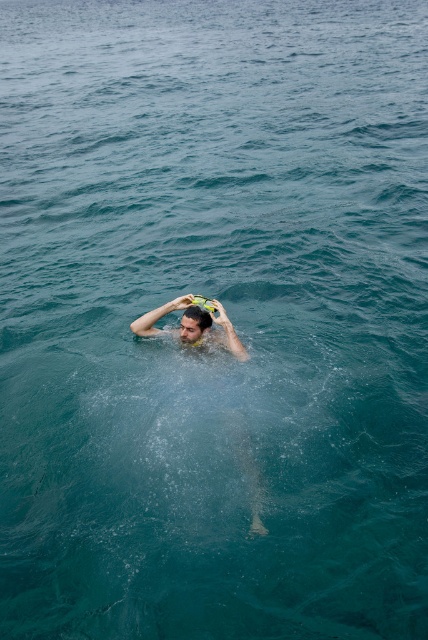
You are a photographer trying to capture the smooth skin man at center and the matte black hair at upper center in a single shot. Which object should you focus on first to ensure both are in focus?

You should focus on the smooth skin man at center first because it is closer to the viewer than the matte black hair at upper center, ensuring that both will be in focus when using a camera with depth of field considerations.